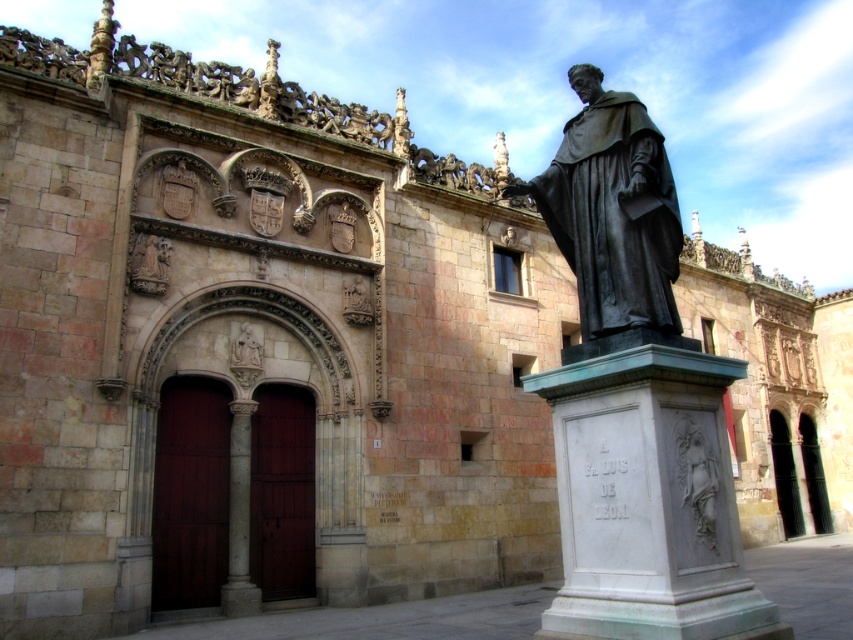
Question: Which object is the farthest from the bronze/statue at right?

Choices:
 (A) white marble pedestal at center
 (B) white marble column at center
 (C) dark gray stone relief at center

Answer: (B)

Question: Which of the following is the closest to the observer?

Choices:
 (A) bronze/statue at right
 (B) polished stone relief at center

Answer: (A)

Question: Can you confirm if white marble pedestal at center is positioned below dark gray stone relief at center?

Choices:
 (A) yes
 (B) no

Answer: (B)

Question: Is bronze/statue at right closer to the viewer compared to dark gray stone relief at center?

Choices:
 (A) yes
 (B) no

Answer: (B)

Question: Is white marble column at center below polished stone relief at center?

Choices:
 (A) yes
 (B) no

Answer: (A)

Question: Which object appears farthest from the camera in this image?

Choices:
 (A) white marble pedestal at center
 (B) polished stone relief at center
 (C) bronze/statue at right
 (D) white marble column at center

Answer: (B)